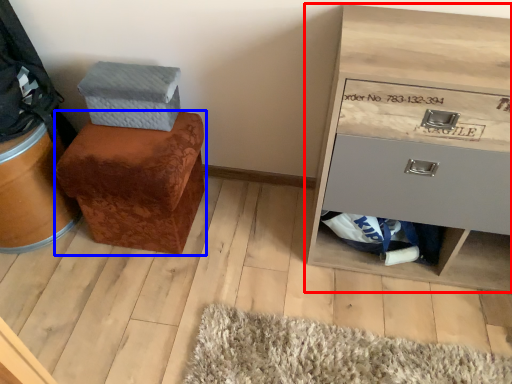
Question: Which of the following is the closest to the observer, chest of drawers (highlighted by a red box) or furniture (highlighted by a blue box)?

Choices:
 (A) chest of drawers
 (B) furniture

Answer: (A)